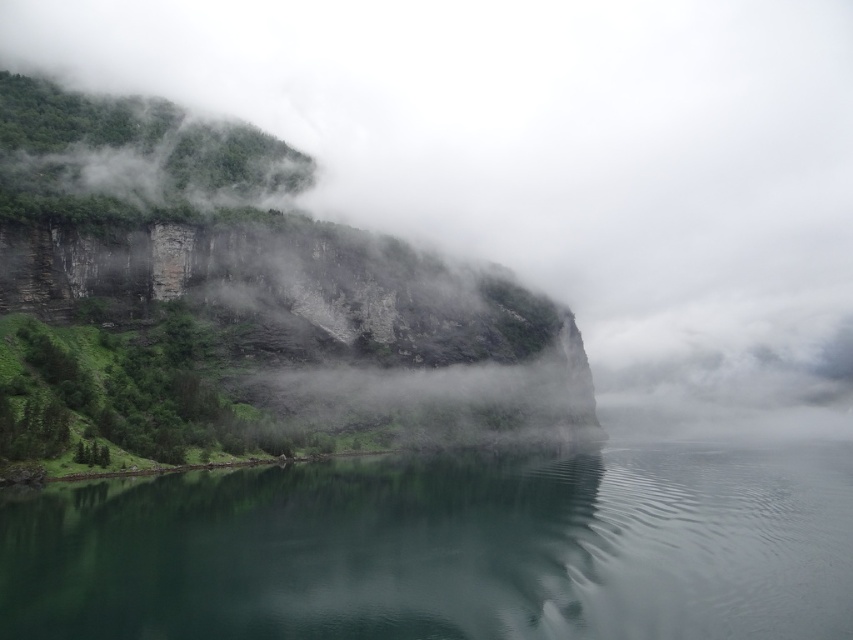
Question: Can you confirm if green reflective water at center is thinner than green mossy rock at left?

Choices:
 (A) no
 (B) yes

Answer: (B)

Question: Where is green reflective water at center located in relation to green mossy rock at left in the image?

Choices:
 (A) right
 (B) left

Answer: (A)

Question: Among these points, which one is farthest from the camera?

Choices:
 (A) (215, 637)
 (B) (88, 412)

Answer: (B)

Question: Which point appears farthest from the camera in this image?

Choices:
 (A) (4, 152)
 (B) (503, 506)

Answer: (A)

Question: Is green reflective water at center below green mossy rock at left?

Choices:
 (A) no
 (B) yes

Answer: (B)